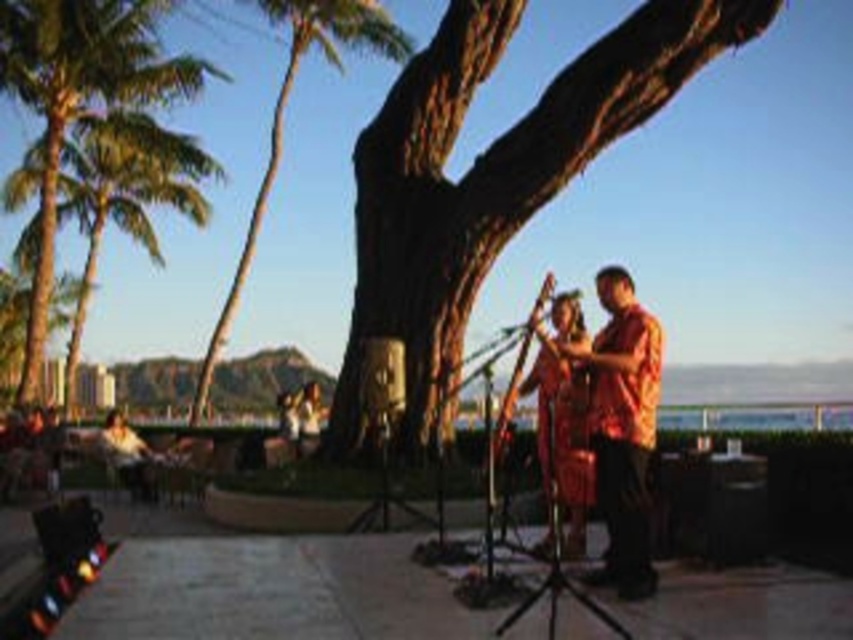
Between green leafy palm tree at left and green leafy palm tree at upper left, which one is positioned higher?

Positioned higher is green leafy palm tree at upper left.

Can you confirm if green leafy palm tree at left is positioned to the left of green leafy palm tree at upper left?

Indeed, green leafy palm tree at left is positioned on the left side of green leafy palm tree at upper left.

Where is `green leafy palm tree at left`? This screenshot has width=853, height=640. green leafy palm tree at left is located at coordinates (80, 99).

Measure the distance between matte orange shirt at center and camera.

matte orange shirt at center and camera are 7.76 meters apart from each other.

Between point (630, 531) and point (267, 176), which one is positioned behind?

The point (267, 176) is behind.

Between point (612, 484) and point (215, 340), which one is positioned behind?

Positioned behind is point (215, 340).

Locate an element on the screen. This screenshot has height=640, width=853. matte orange shirt at center is located at coordinates (622, 428).

Who is taller, brown rough bark tree at center or matte orange shirt at center?

Standing taller between the two is brown rough bark tree at center.

Locate an element on the screen. The height and width of the screenshot is (640, 853). brown rough bark tree at center is located at coordinates (490, 179).